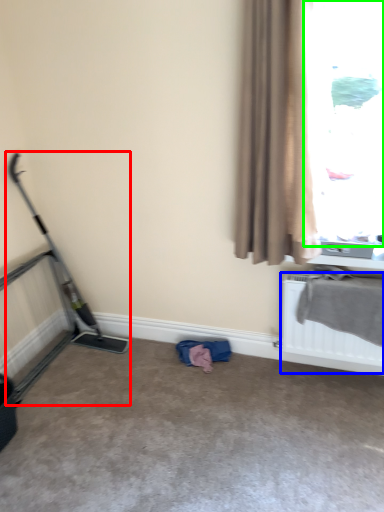
Question: Which is farther away from baby carriage (highlighted by a red box)? radiator (highlighted by a blue box) or window (highlighted by a green box)?

Choices:
 (A) radiator
 (B) window

Answer: (B)